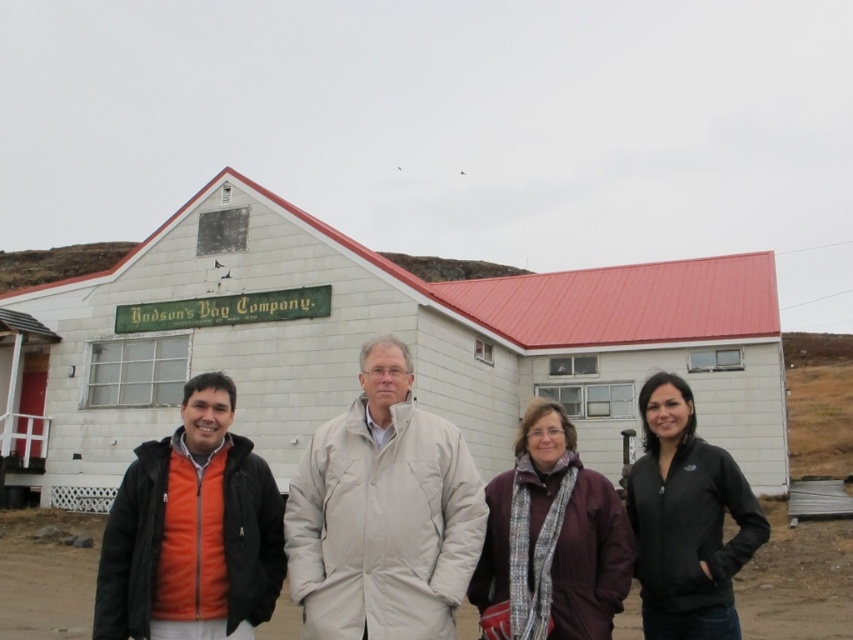
You are standing in front of the building with a red roof and white walls. There are four people dressed in warm clothing. The first person from the left wears a black jacket over an orange shirt, the second has a light beige jacket, the third a maroon jacket with a patterned scarf, and the fourth. You notice a point at coordinates (383, 513). Which person is located at this point?

The point at coordinates (383, 513) indicates the beige fabric coat at center, so the second individual with the light beige jacket is located at that point.

From the picture: You are standing in front of the Hudson Bay Company building and see two points marked on the ground. The first point is at coordinate point [395,579] and the second is at point [608,484]. If you want to walk towards the building, which point should you step on first?

Point [395,579] is in front of point [608,484], so you should step on point [395,579] first to walk towards the building.

You are standing in front of the white brick building at center. What are the coordinates of the building?

The white brick building at center is located at coordinates (x=376, y=332).